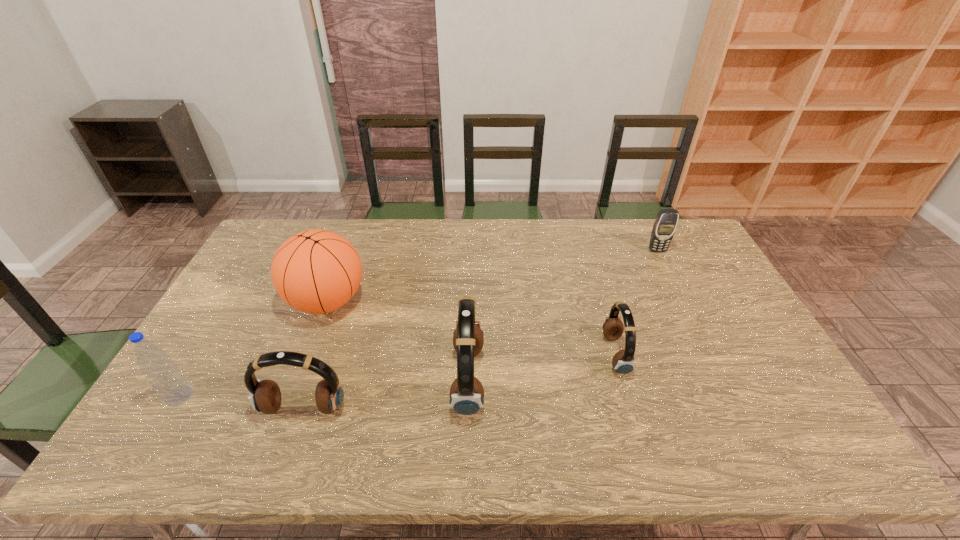
Identify the location of free location at the far edge of the desktop. (476, 226).

In the image, there is a desktop. Identify the location of vacant space at the near edge. (381, 402).

The height and width of the screenshot is (540, 960). Identify the location of vacant space at the right edge. (708, 273).

Locate an element on the screen. The height and width of the screenshot is (540, 960). vacant region at the far right corner of the desktop is located at coordinates (x=690, y=230).

Identify the location of free space that is in between the second shortest headset and the leftmost object. (241, 402).

In order to click on vacant area between the second farthest object and the leftmost object in this screenshot , I will do `click(253, 348)`.

What are the coordinates of `blank region between the farthest object and the third object from right to left` in the screenshot? It's located at (563, 315).

Identify the location of unoccupied position between the basketball and the second shortest headset. This screenshot has height=540, width=960. (316, 355).

Locate an element on the screen. The width and height of the screenshot is (960, 540). vacant area between the third object from right to left and the shortest headset is located at coordinates (541, 367).

This screenshot has height=540, width=960. Identify the location of unoccupied position between the fourth object from left to right and the second object from right to left. (541, 367).